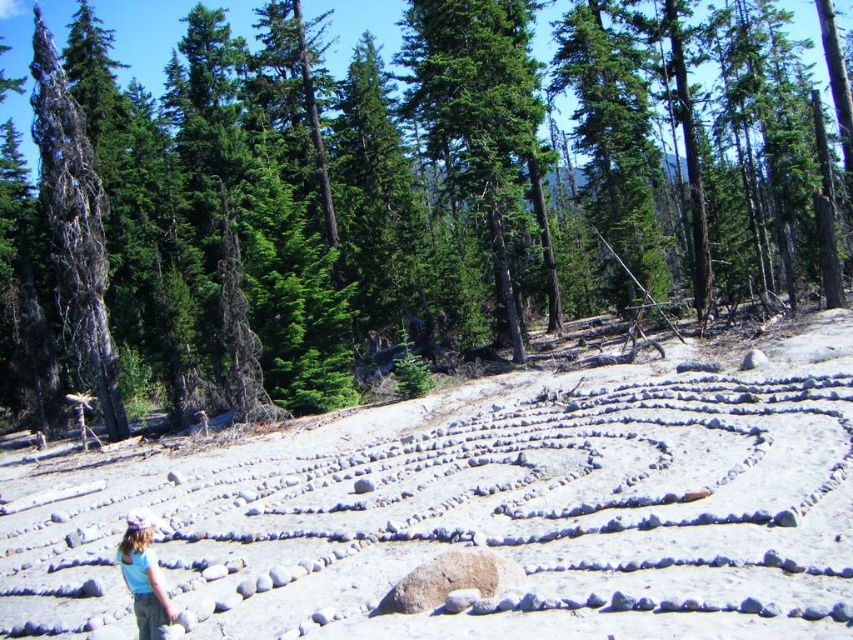
You are standing at the center of the stone labyrinth in the foreground. Looking towards the gray bark tree at left, what is its approximate 2D coordinate position in the image?

The gray bark tree at left is located at the 2D coordinate point of approximately 0.353 in the x direction and 0.088 in the y direction.

You are standing at the entrance of the stone labyrinth in the foreground. You want to walk towards the green evergreen tree at center located at point (x=396, y=195). Is the path through the labyrinth leading directly to this point obstructed by any dead or charred trees?

The green evergreen tree at center is located at point (x=396, y=195). The forest in the middle ground contains dead or charred trees, but the labyrinth pathways are made of stones and gravel, so the path through the labyrinth leading directly to the point is not obstructed by dead or charred trees.